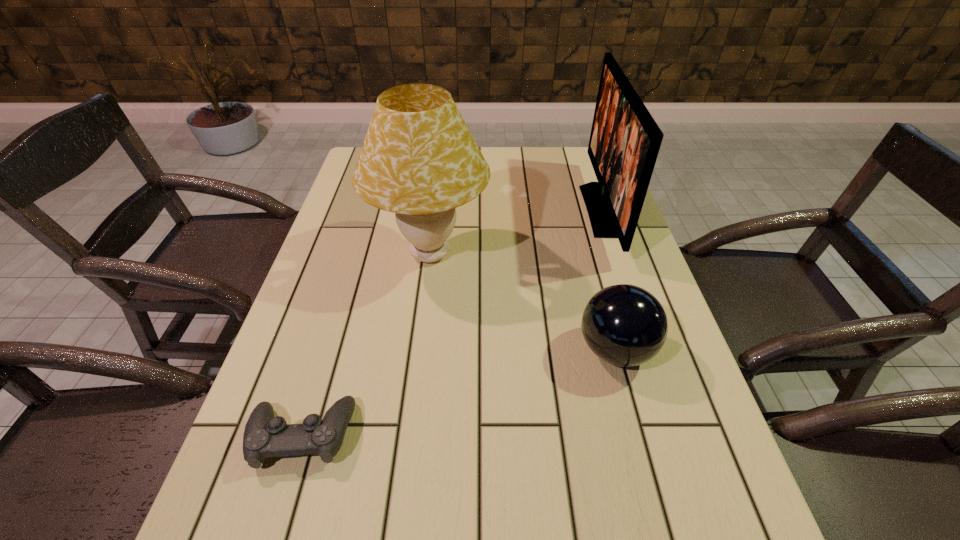
Identify the location of lampshade. (419, 160).

Image resolution: width=960 pixels, height=540 pixels. Identify the location of monitor. point(625,140).

Identify the location of the third tallest object. The height and width of the screenshot is (540, 960). (624, 325).

Locate an element on the screen. The image size is (960, 540). the second nearest object is located at coordinates (624, 325).

At what (x,y) coordinates should I click in order to perform the action: click on control. Please return your answer as a coordinate pair (x, y). Looking at the image, I should click on (265, 436).

Locate an element on the screen. This screenshot has width=960, height=540. the shortest object is located at coordinates (265, 436).

Identify the location of blank space located on the back of the lampshade. Image resolution: width=960 pixels, height=540 pixels. (437, 199).

Where is `vacant region located on the front-facing side of the monitor`? This screenshot has width=960, height=540. vacant region located on the front-facing side of the monitor is located at coordinates (511, 211).

Locate an element on the screen. Image resolution: width=960 pixels, height=540 pixels. vacant space located on the front-facing side of the monitor is located at coordinates (490, 211).

I want to click on vacant space located on the front-facing side of the monitor, so tap(517, 211).